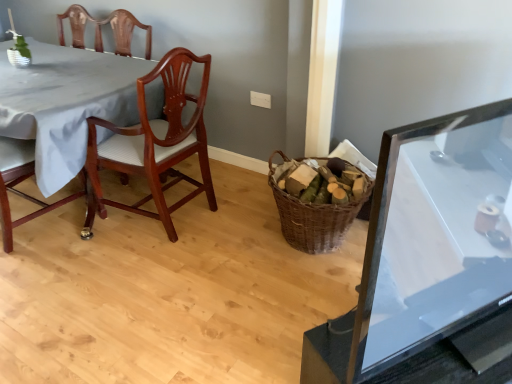
Identify the location of free point in front of woven brown basket at center. (297, 291).